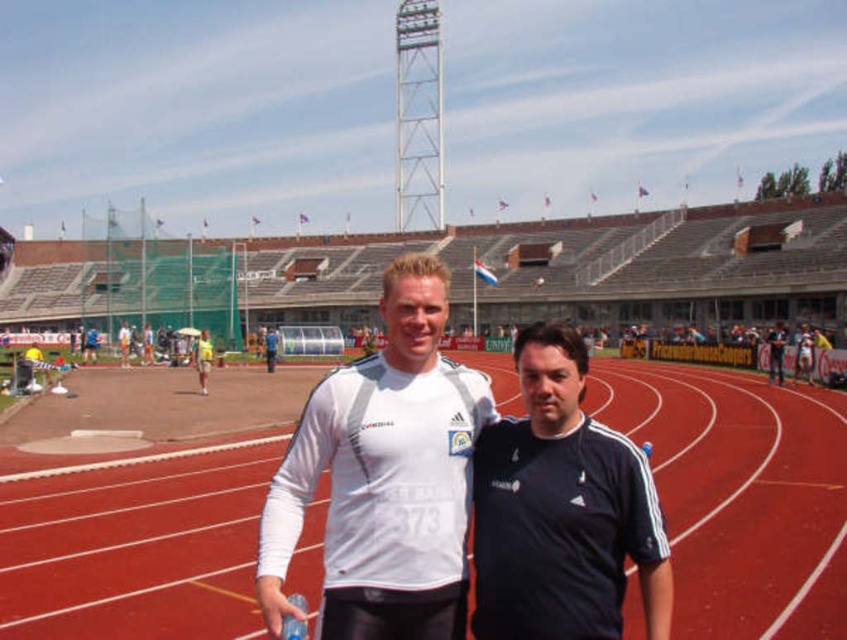
Measure the distance between point (619, 433) and camera.

They are 16.13 meters apart.

Which is behind, point (616, 504) or point (206, 390)?

The point (206, 390) is behind.

I want to click on black matte shirt at center, so click(x=562, y=509).

Measure the distance between white matte jersey at center and camera.

white matte jersey at center and camera are 9.53 meters apart from each other.

Can you confirm if white matte jersey at center is taller than black matte shirt at center?

Indeed, white matte jersey at center has a greater height compared to black matte shirt at center.

Is point (457, 378) positioned in front of point (502, 556)?

No, (457, 378) is behind (502, 556).

The height and width of the screenshot is (640, 847). Identify the location of white matte jersey at center. (385, 476).

Can you confirm if red rubber track at center is taller than yellow fabric shorts at center?

Incorrect, red rubber track at center's height is not larger of yellow fabric shorts at center's.

Which is more to the right, red rubber track at center or yellow fabric shorts at center?

red rubber track at center

Is point (29, 561) positioned after point (197, 376)?

No, (29, 561) is in front of (197, 376).

The height and width of the screenshot is (640, 847). I want to click on red rubber track at center, so tap(740, 493).